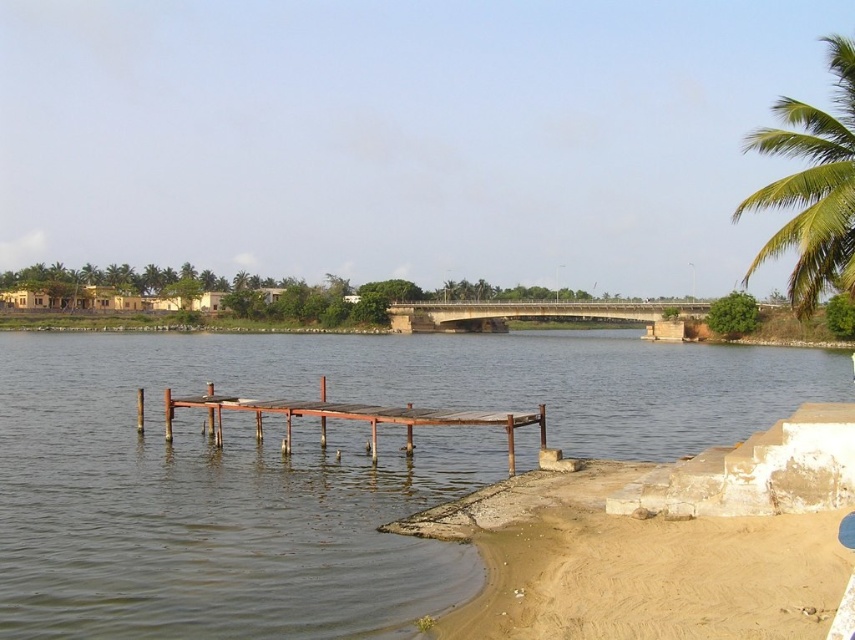
Question: Which point is farther from the camera taking this photo?

Choices:
 (A) (805, 637)
 (B) (513, 461)
 (C) (21, 442)
 (D) (847, 86)

Answer: (C)

Question: Can you confirm if brown wooden dock at center is positioned to the right of rusty wood dock at center?

Choices:
 (A) no
 (B) yes

Answer: (B)

Question: Is brown wooden dock at center to the right of green leafy palm tree at upper right from the viewer's perspective?

Choices:
 (A) no
 (B) yes

Answer: (A)

Question: Which point is closer to the camera?

Choices:
 (A) rusty wood dock at center
 (B) green leafy palm tree at upper right

Answer: (B)

Question: Does brown wooden dock at center appear under green leafy palm tree at upper right?

Choices:
 (A) yes
 (B) no

Answer: (A)

Question: Which object is the closest to the brown wooden dock at center?

Choices:
 (A) rusty wood dock at center
 (B) brown sandy beach at lower right
 (C) green leafy palm tree at upper right

Answer: (A)